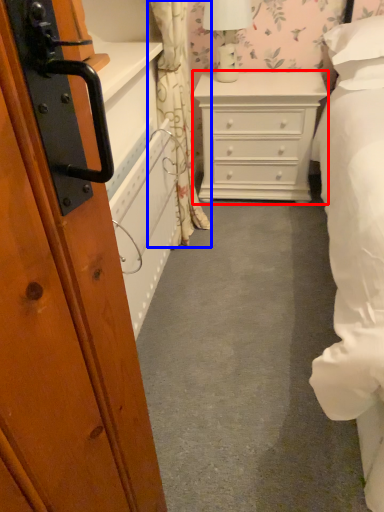
Question: Which object appears farthest to the camera in this image, chest of drawers (highlighted by a red box) or curtain (highlighted by a blue box)?

Choices:
 (A) chest of drawers
 (B) curtain

Answer: (A)